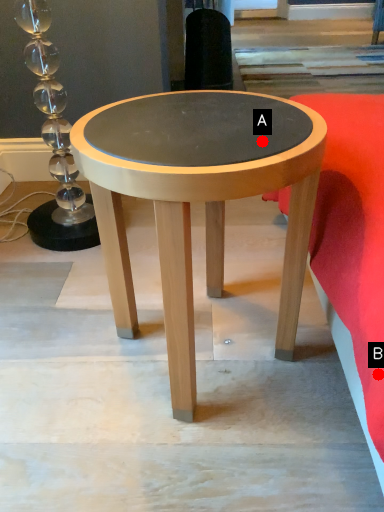
Question: Two points are circled on the image, labeled by A and B beside each circle. Which point is closer to the camera?

Choices:
 (A) A is closer
 (B) B is closer

Answer: (B)